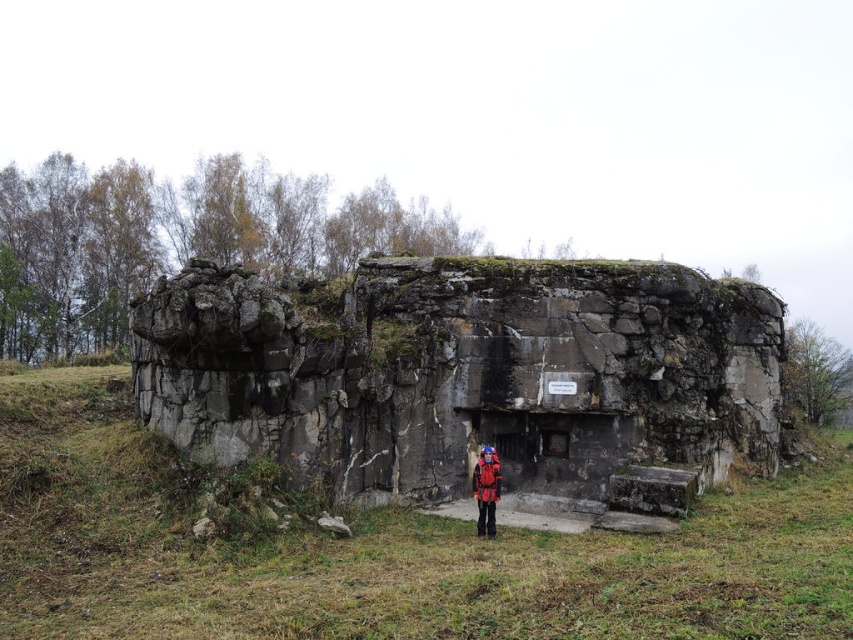
Is rusty stone bunker at center wider than red fabric jacket at center?

Indeed, rusty stone bunker at center has a greater width compared to red fabric jacket at center.

Does rusty stone bunker at center have a smaller size compared to red fabric jacket at center?

No.

Find the location of `rusty stone bunker at center`. rusty stone bunker at center is located at coordinates (467, 374).